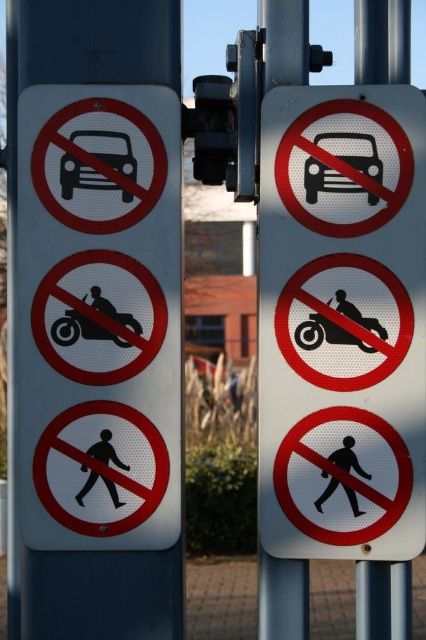
You are standing in front of two traffic signs mounted on a blue metal pole. The left sign has three red circle prohibition symbols. The right sign also has three similar symbols. You notice a specific point at coordinates point (98, 317). Which sign is this point located on?

The point (98, 317) is located on the white metallic sign at left.

You are a delivery driver approaching the intersection and see the white metallic sign at left and the black glossy car at upper left. Which object is wider from your perspective?

The white metallic sign at left is wider than the black glossy car at upper left according to the description.

You are standing in front of a blue metal pole with two vertical rectangular signs. The left sign has three prohibition symbols. Can you tell me the exact 2D coordinates of the white metallic sign at left?

The white metallic sign at left is located at the 2D coordinates point [98,317].